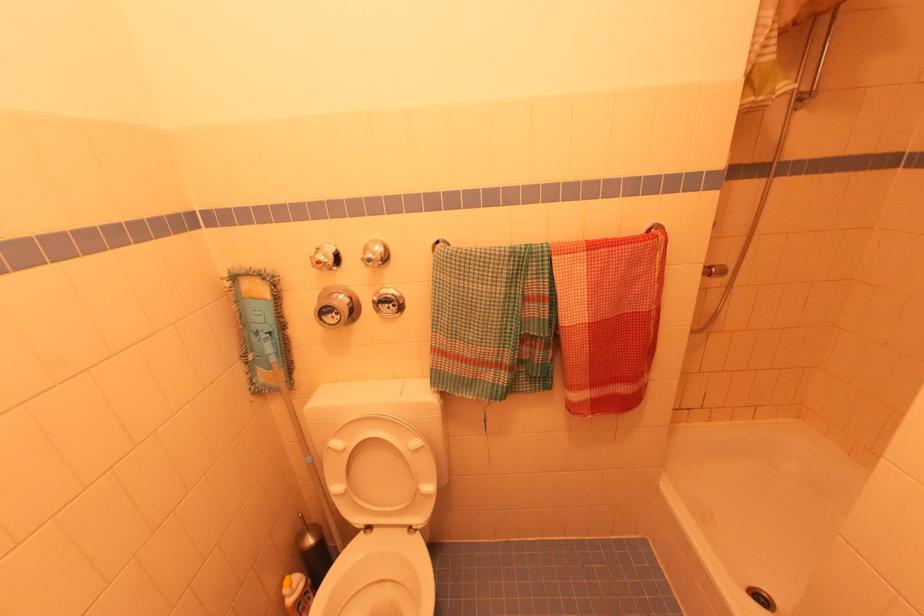
This screenshot has width=924, height=616. Describe the element at coordinates (375, 253) in the screenshot. I see `the blue-marked wall knob` at that location.